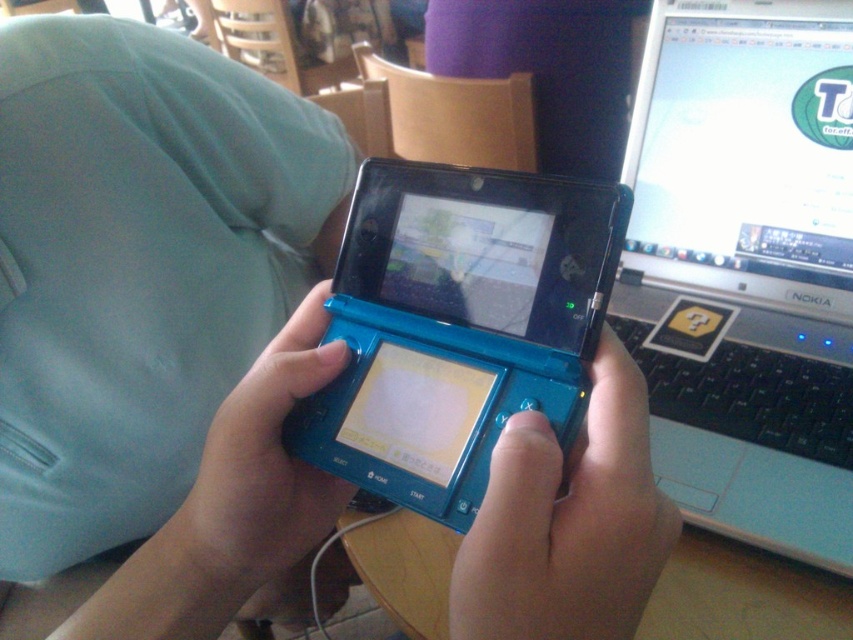
Question: Which point appears closest to the camera in this image?

Choices:
 (A) (654, 531)
 (B) (643, 212)
 (C) (393, 307)
 (D) (815, 492)

Answer: (A)

Question: From the image, what is the correct spatial relationship of silver/black plastic laptop at right in relation to matte plastic laptop at upper right?

Choices:
 (A) below
 (B) above

Answer: (A)

Question: Can you confirm if teal plastic game console at center is thinner than matte plastic laptop at upper right?

Choices:
 (A) yes
 (B) no

Answer: (A)

Question: Can you confirm if teal plastic game console at center is positioned to the right of teal plastic handheld gaming console at center?

Choices:
 (A) yes
 (B) no

Answer: (B)

Question: Considering the real-world distances, which object is farthest from the teal plastic game controller at center?

Choices:
 (A) silver/black plastic laptop at right
 (B) blue rubberized controller at center

Answer: (A)

Question: Which point is farther to the camera?

Choices:
 (A) (376, 257)
 (B) (804, 51)

Answer: (B)